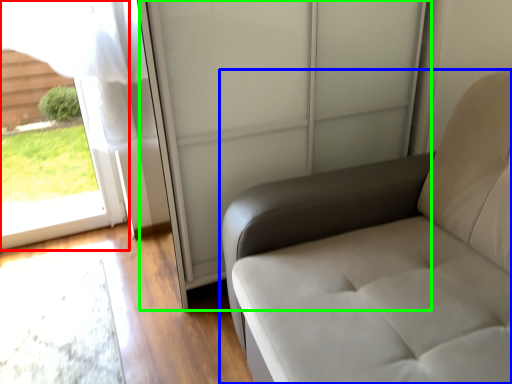
Question: Considering the real-world distances, which object is closest to window (highlighted by a red box)? furniture (highlighted by a blue box) or screen door (highlighted by a green box).

Choices:
 (A) furniture
 (B) screen door

Answer: (B)